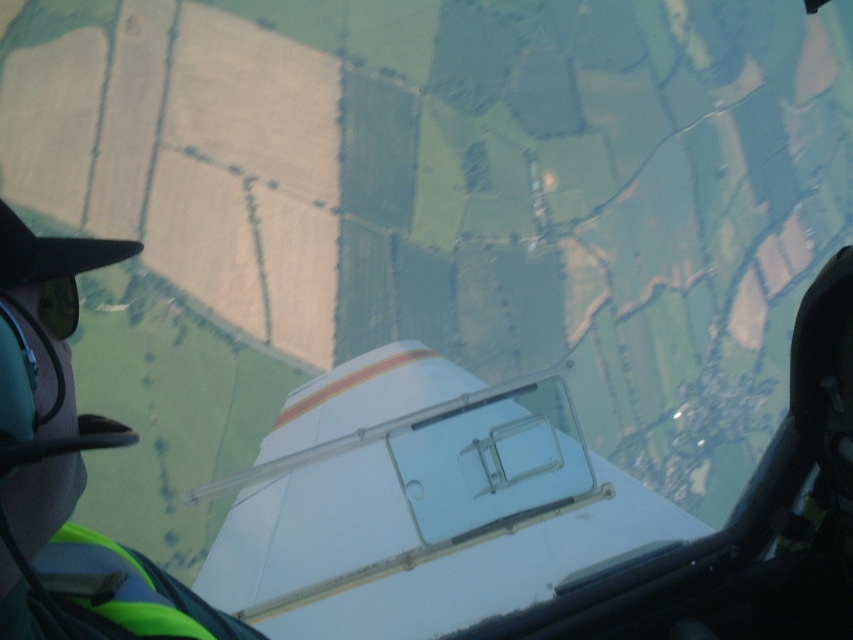
Is white glossy airplane at center in front of green fabric pilot at left?

No, white glossy airplane at center is further to the viewer.

Can you confirm if white glossy airplane at center is taller than green fabric pilot at left?

Incorrect, white glossy airplane at center's height is not larger of green fabric pilot at left's.

Between point (268, 541) and point (16, 273), which one is positioned in front?

Point (16, 273)

Image resolution: width=853 pixels, height=640 pixels. I want to click on white glossy airplane at center, so point(498,499).

Who is taller, transparent plastic airplane window at center or green matte goggles at lower left?

→ Standing taller between the two is transparent plastic airplane window at center.

Measure the distance between transparent plastic airplane window at center and camera.

A distance of 3.05 meters exists between transparent plastic airplane window at center and camera.

Where is `transparent plastic airplane window at center`? The image size is (853, 640). transparent plastic airplane window at center is located at coordinates (490, 460).

Between point (78, 604) and point (62, 308), which one is positioned in front?

Point (62, 308) is more forward.

Can you confirm if green fabric pilot at left is positioned above green matte goggles at lower left?

Incorrect, green fabric pilot at left is not positioned above green matte goggles at lower left.

Measure the distance between green fabric pilot at left and camera.

32.72 inches

Identify the location of green fabric pilot at left. (68, 477).